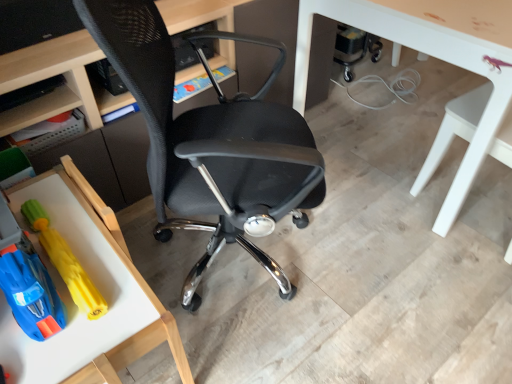
The width and height of the screenshot is (512, 384). What do you see at coordinates (433, 56) in the screenshot?
I see `white glossy table at lower right, which is the first table in right-to-left order` at bounding box center [433, 56].

This screenshot has width=512, height=384. Describe the element at coordinates (65, 262) in the screenshot. I see `yellow rubber toy at lower left, marked as the second toy in a left-to-right arrangement` at that location.

At what (x,y) coordinates should I click in order to perform the action: click on white glossy table at right, which ranks as the first chair in right-to-left order. Please return your answer as a coordinate pair (x, y). This screenshot has width=512, height=384. Looking at the image, I should click on (470, 144).

The image size is (512, 384). Describe the element at coordinates (109, 160) in the screenshot. I see `matte black desk at center` at that location.

In order to face matte black shelf at upper left, should I rotate leftwards or rightwards?

To align with it, rotate left about 29.615°.

I want to click on wooden tray at lower left, the 2th table when ordered from top to bottom, so click(96, 286).

Which object is closer to the camera, rubberized yellow toy at lower left, the second toy when ordered from right to left, or wooden tray at lower left, arranged as the first table when viewed from the left?

wooden tray at lower left, arranged as the first table when viewed from the left, is more forward.

Is rubberized yellow toy at lower left, the second toy when ordered from right to left, bigger than wooden tray at lower left, the 2th table when ordered from top to bottom?

No.

Can you confirm if rubberized yellow toy at lower left, the first toy positioned from the left, is thinner than wooden tray at lower left, arranged as the first table when viewed from the left?

Correct, the width of rubberized yellow toy at lower left, the first toy positioned from the left, is less than that of wooden tray at lower left, arranged as the first table when viewed from the left.

Could you tell me if matte black desk at center is turned towards yellow rubber toy at lower left, marked as the second toy in a left-to-right arrangement?

Yes, matte black desk at center is facing yellow rubber toy at lower left, marked as the second toy in a left-to-right arrangement.

Where is `the 2nd toy below the matte black desk at center (from the image's perspective)`? This screenshot has height=384, width=512. the 2nd toy below the matte black desk at center (from the image's perspective) is located at coordinates (65, 262).

Is matte black desk at center positioned beyond the bounds of yellow rubber toy at lower left, marked as the second toy in a left-to-right arrangement?

Yes.

Is white glossy table at lower right, which is counted as the second table, starting from the left, not near rubberized yellow toy at lower left, the second toy when ordered from right to left?

Yes, white glossy table at lower right, which is counted as the second table, starting from the left, and rubberized yellow toy at lower left, the second toy when ordered from right to left, are located far from each other.

In terms of height, does white glossy table at lower right, the second table ordered from the bottom, look taller or shorter compared to rubberized yellow toy at lower left, the second toy when ordered from right to left?

In the image, white glossy table at lower right, the second table ordered from the bottom, appears to be taller than rubberized yellow toy at lower left, the second toy when ordered from right to left.

Considering the relative positions of white glossy table at lower right, the second table ordered from the bottom, and rubberized yellow toy at lower left, the first toy positioned from the left, in the image provided, is white glossy table at lower right, the second table ordered from the bottom, to the left or to the right of rubberized yellow toy at lower left, the first toy positioned from the left,?

From the image, it's evident that white glossy table at lower right, the second table ordered from the bottom, is to the right of rubberized yellow toy at lower left, the first toy positioned from the left.

Consider the image. Could you tell me if white glossy table at lower right, marked as the 1th table in a top-to-bottom arrangement, is facing rubberized yellow toy at lower left, the first toy positioned from the left?

No, white glossy table at lower right, marked as the 1th table in a top-to-bottom arrangement, is not aimed at rubberized yellow toy at lower left, the first toy positioned from the left.

Can you tell me how much black mesh chair at center, which is the second chair from right to left, and white glossy table at right, the second chair in the left-to-right sequence, differ in facing direction?

black mesh chair at center, which is the second chair from right to left, and white glossy table at right, the second chair in the left-to-right sequence, are facing 119 degrees away from each other.

From the image's perspective, which one is positioned higher, black mesh chair at center, which is the second chair from right to left, or white glossy table at right, which ranks as the first chair in right-to-left order?

white glossy table at right, which ranks as the first chair in right-to-left order, from the image's perspective.

Does point (123, 53) lie behind point (455, 191)?

No, it is not.

Locate an element on the screen. chair on the right side of black mesh chair at center, which is the second chair from right to left is located at coordinates (470, 144).

Is matte black desk at center next to matte black shelf at upper left?

No, matte black desk at center is not touching matte black shelf at upper left.

Consider the image. Is matte black shelf at upper left located within matte black desk at center?

Absolutely, matte black shelf at upper left is inside matte black desk at center.

Locate an element on the screen. desk on the right of matte black shelf at upper left is located at coordinates (109, 160).

Between point (8, 297) and point (100, 303), which one is positioned in front?

The point (8, 297) is closer to the camera.

Measure the distance from rubberized yellow toy at lower left, the second toy when ordered from right to left, to yellow rubber toy at lower left, marked as the second toy in a left-to-right arrangement.

They are 4.27 inches apart.

Is rubberized yellow toy at lower left, the first toy positioned from the left, inside or outside of yellow rubber toy at lower left, marked as the second toy in a left-to-right arrangement?

rubberized yellow toy at lower left, the first toy positioned from the left, is outside yellow rubber toy at lower left, marked as the second toy in a left-to-right arrangement.

Considering the sizes of objects rubberized yellow toy at lower left, the second toy when ordered from right to left, and yellow rubber toy at lower left, the 1th toy from the right, in the image provided, who is taller, rubberized yellow toy at lower left, the second toy when ordered from right to left, or yellow rubber toy at lower left, the 1th toy from the right,?

rubberized yellow toy at lower left, the second toy when ordered from right to left.

From a real-world perspective, is matte black shelf at upper left on top of yellow rubber toy at lower left, marked as the second toy in a left-to-right arrangement?

Correct, in the physical world, matte black shelf at upper left is higher than yellow rubber toy at lower left, marked as the second toy in a left-to-right arrangement.

Looking at this image, can you confirm if matte black shelf at upper left is taller than yellow rubber toy at lower left, the 1th toy from the right?

Indeed, matte black shelf at upper left has a greater height compared to yellow rubber toy at lower left, the 1th toy from the right.

Does matte black shelf at upper left contain yellow rubber toy at lower left, the 1th toy from the right?

No, matte black shelf at upper left does not contain yellow rubber toy at lower left, the 1th toy from the right.

At what (x,y) coordinates should I click in order to perform the action: click on the 1st table counting from the right of the rubberized yellow toy at lower left, the first toy positioned from the left. Please return your answer as a coordinate pair (x, y). The image size is (512, 384). Looking at the image, I should click on (96, 286).

The image size is (512, 384). I want to click on the 1st toy in front of the matte black desk at center, so click(65, 262).

When comparing their distances from yellow rubber toy at lower left, the 1th toy from the right, does wooden tray at lower left, placed as the 2th table when sorted from right to left, or white glossy table at lower right, which is the first table in right-to-left order, seem closer?

Based on the image, wooden tray at lower left, placed as the 2th table when sorted from right to left, appears to be nearer to yellow rubber toy at lower left, the 1th toy from the right.

Estimate the real-world distances between objects in this image. Which object is further from yellow rubber toy at lower left, marked as the second toy in a left-to-right arrangement, matte black shelf at upper left or white glossy table at right, the second chair in the left-to-right sequence?

The object further to yellow rubber toy at lower left, marked as the second toy in a left-to-right arrangement, is white glossy table at right, the second chair in the left-to-right sequence.

From the image, which object appears to be nearer to matte black shelf at upper left, yellow rubber toy at lower left, the 1th toy from the right, or black mesh chair at center, which is the second chair from right to left?

yellow rubber toy at lower left, the 1th toy from the right, is closer to matte black shelf at upper left.

Estimate the real-world distances between objects in this image. Which object is further from black mesh chair at center, which is the second chair from right to left, rubberized yellow toy at lower left, the second toy when ordered from right to left, or yellow rubber toy at lower left, marked as the second toy in a left-to-right arrangement?

rubberized yellow toy at lower left, the second toy when ordered from right to left.

From the image, which object appears to be farther from black mesh chair at center, which appears as the 1th chair when viewed from the left, matte black desk at center or wooden tray at lower left, the 2th table when ordered from top to bottom?

matte black desk at center is positioned further to the anchor black mesh chair at center, which appears as the 1th chair when viewed from the left.

When comparing their distances from white glossy table at lower right, marked as the 1th table in a top-to-bottom arrangement, does yellow rubber toy at lower left, the 1th toy from the right, or rubberized yellow toy at lower left, the first toy positioned from the left, seem closer?

yellow rubber toy at lower left, the 1th toy from the right, is positioned closer to the anchor white glossy table at lower right, marked as the 1th table in a top-to-bottom arrangement.

Based on the photo, which object lies further to the anchor point matte black shelf at upper left, white glossy table at right, which ranks as the first chair in right-to-left order, or rubberized yellow toy at lower left, the second toy when ordered from right to left?

white glossy table at right, which ranks as the first chair in right-to-left order.

Looking at the image, which one is located further to white glossy table at right, the second chair in the left-to-right sequence, yellow rubber toy at lower left, marked as the second toy in a left-to-right arrangement, or matte black desk at center?

yellow rubber toy at lower left, marked as the second toy in a left-to-right arrangement, is positioned further to the anchor white glossy table at right, the second chair in the left-to-right sequence.

You are a GUI agent. You are given a task and a screenshot of the screen. Output one action in this format:
    pyautogui.click(x=<x>, y=<y>)
    Task: Click on the desk between rubberized yellow toy at lower left, the first toy positioned from the left, and white glossy table at lower right, the second table ordered from the bottom
    
    Given the screenshot: What is the action you would take?
    pyautogui.click(x=109, y=160)

Where is `chair located between rubberized yellow toy at lower left, the first toy positioned from the left, and white glossy table at lower right, which is counted as the second table, starting from the left, in the left-right direction`? Image resolution: width=512 pixels, height=384 pixels. chair located between rubberized yellow toy at lower left, the first toy positioned from the left, and white glossy table at lower right, which is counted as the second table, starting from the left, in the left-right direction is located at coordinates (209, 146).

Locate an element on the screen. chair between rubberized yellow toy at lower left, the first toy positioned from the left, and white glossy table at right, which ranks as the first chair in right-to-left order, in the horizontal direction is located at coordinates (209, 146).

At what (x,y) coordinates should I click in order to perform the action: click on chair between matte black desk at center and white glossy table at lower right, which is the first table in right-to-left order, in the horizontal direction. Please return your answer as a coordinate pair (x, y). Looking at the image, I should click on (209, 146).